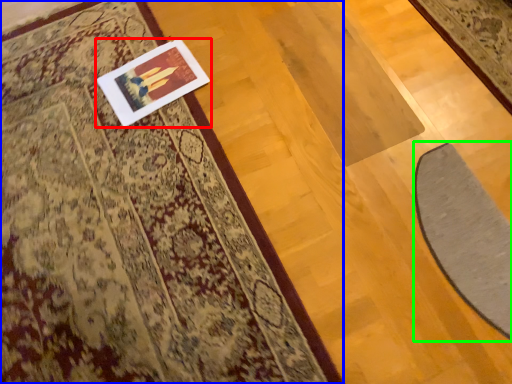
Question: Considering the real-world distances, which object is closest to picture frame (highlighted by a red box)? mat (highlighted by a blue box) or doormat (highlighted by a green box).

Choices:
 (A) mat
 (B) doormat

Answer: (A)